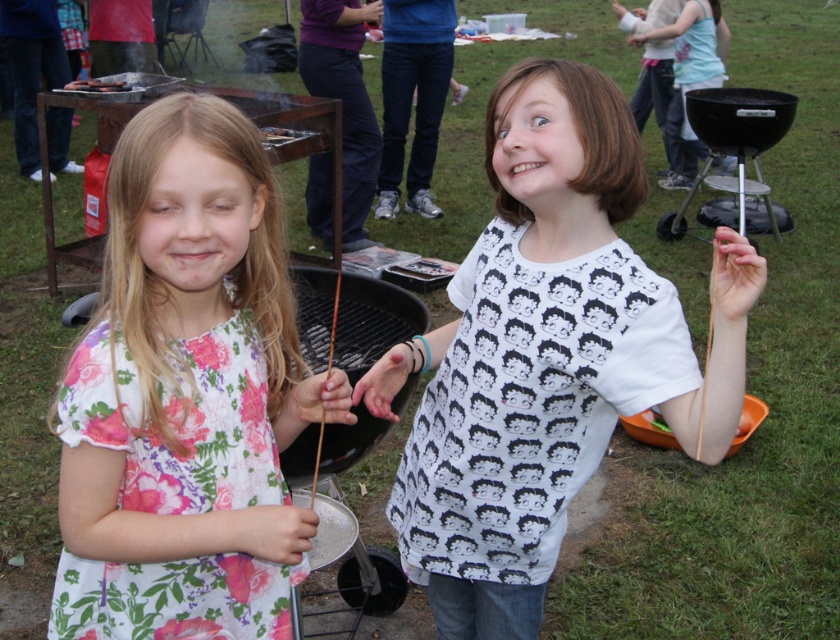
What object is located at the coordinates point [546,355] in the image?

The point [546,355] corresponds to the white printed shirt at center.

You are a photographer at the barbecue and want to take a photo of both the white printed shirt at center and the white printed shirt at upper right. Which shirt is positioned closer to the camera?

The white printed shirt at center is closer to the viewer than the white printed shirt at upper right, so the shirt at center would appear closer to the camera.

You are standing in the barbecue area and want to place a new grill mat. The mat needs to be placed between the two points labeled point (234, 248) and point (691, 72). Based on their positions, which point should the mat be closer to?

The mat should be closer to point (234, 248) because it is in front of point (691, 72).